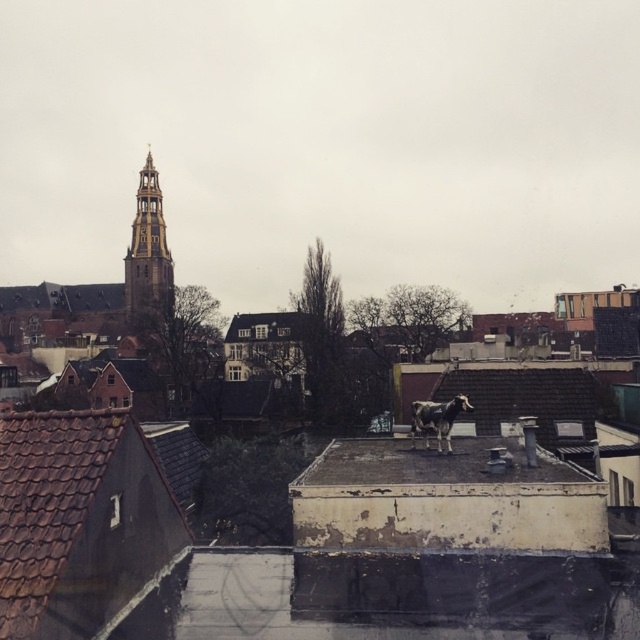
You are standing on the ground floor of a building and looking towards the rusty metal roof at center and the golden wood tower at upper left. Which object is closer to you?

The rusty metal roof at center is closer to you because it is in front of the golden wood tower at upper left.

What is the location of the point with coordinates (x=147, y=257) in the cityscape image?

The point with coordinates (x=147, y=257) is located on the golden wood tower at upper left.